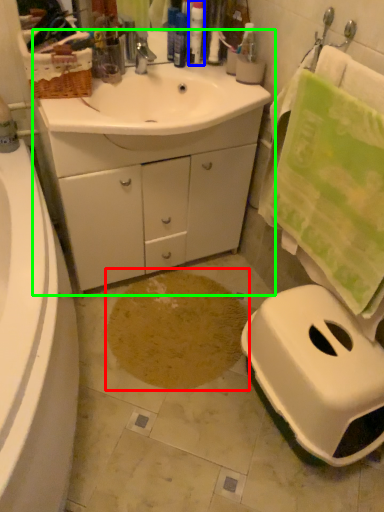
Question: Considering the real-world distances, which object is farthest from footprint (highlighted by a red box)? toiletry (highlighted by a blue box) or bathroom cabinet (highlighted by a green box)?

Choices:
 (A) toiletry
 (B) bathroom cabinet

Answer: (A)